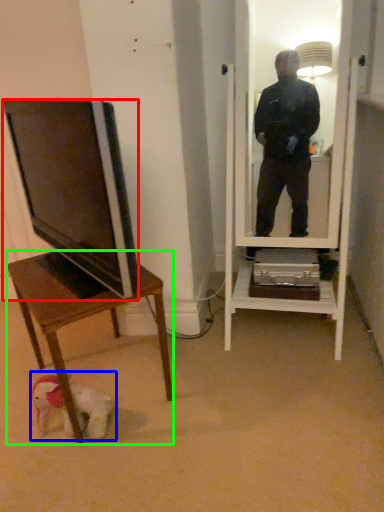
Question: Which object is the farthest from television (highlighted by a red box)? Choose among these: dog (highlighted by a blue box) or desk (highlighted by a green box).

Choices:
 (A) dog
 (B) desk

Answer: (A)